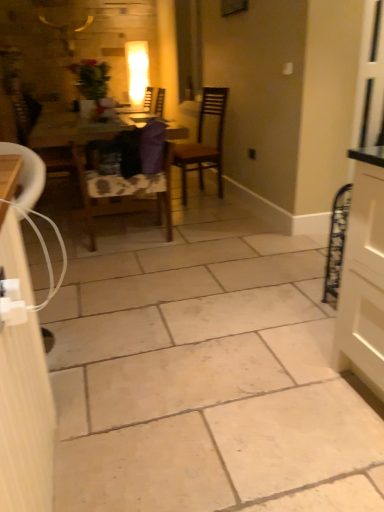
Image resolution: width=384 pixels, height=512 pixels. I want to click on unoccupied region to the right of white glossy cabinet at left, so click(x=110, y=338).